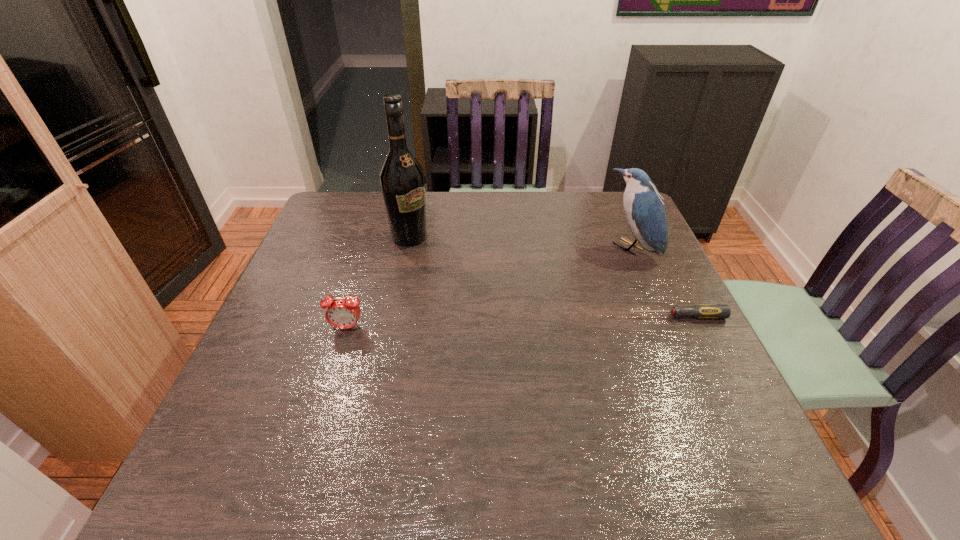
Locate an element on the screen. vacant spot on the desktop that is between the second shortest object and the second nearest object and is positioned at the tip of the second tallest object's beak is located at coordinates (521, 322).

This screenshot has height=540, width=960. What are the coordinates of `free space on the desktop that is between the second shortest object and the shortest object and is positioned on the label of the wine bottle` in the screenshot? It's located at (539, 321).